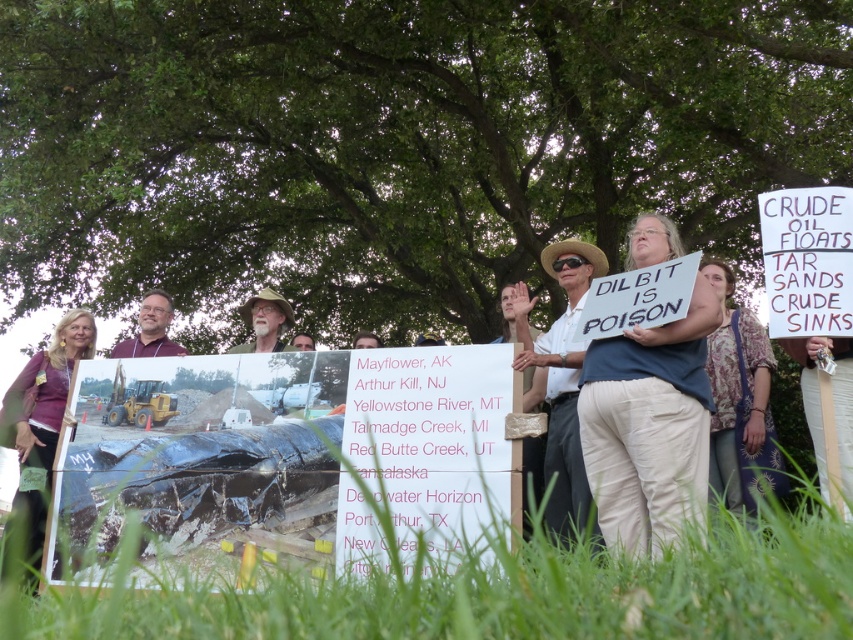
Who is shorter, green grass at lower center or purple fabric shirt at center?

green grass at lower center

Which is below, green grass at lower center or purple fabric shirt at center?

purple fabric shirt at center is lower down.

Who is more distant from viewer, [264,592] or [36,582]?

The point [36,582] is behind.

You are a GUI agent. You are given a task and a screenshot of the screen. Output one action in this format:
    pyautogui.click(x=<x>, y=<y>)
    Task: Click on the green grass at lower center
    This screenshot has height=640, width=853.
    Given the screenshot: What is the action you would take?
    pyautogui.click(x=502, y=595)

Can you confirm if white paper sign at center is positioned below floral fabric shirt at upper right?

Correct, white paper sign at center is located below floral fabric shirt at upper right.

Can you confirm if white paper sign at center is positioned to the right of floral fabric shirt at upper right?

In fact, white paper sign at center is to the left of floral fabric shirt at upper right.

The height and width of the screenshot is (640, 853). What do you see at coordinates (426, 454) in the screenshot? I see `white paper sign at center` at bounding box center [426, 454].

Locate an element on the screen. The width and height of the screenshot is (853, 640). white paper sign at center is located at coordinates (426, 454).

Can you confirm if purple fabric shirt at center is positioned below matte purple shirt at center?

Correct, purple fabric shirt at center is located below matte purple shirt at center.

Can you confirm if purple fabric shirt at center is wider than matte purple shirt at center?

Yes.

Identify the location of purple fabric shirt at center. This screenshot has width=853, height=640. (39, 433).